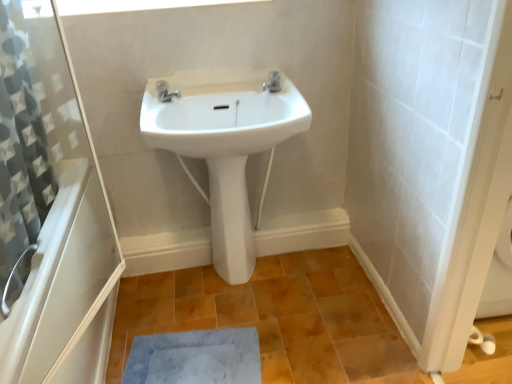
Question: From a real-world perspective, relative to satin nickel faucet at center, which is counted as the first tap, starting from the right, is white glossy bidet at center vertically above or below?

Choices:
 (A) below
 (B) above

Answer: (A)

Question: In the image, is white glossy bidet at center positioned in front of or behind satin nickel faucet at center, which is counted as the first tap, starting from the right?

Choices:
 (A) front
 (B) behind

Answer: (B)

Question: Based on their relative distances, which object is farther from the blue fuzzy mat at lower center?

Choices:
 (A) transparent plastic window screen at upper center
 (B) white glossy bath at lower left
 (C) white ceramic sink at center
 (D) polished chrome tap at upper center, the second tap positioned from the right
 (E) satin nickel faucet at center, the second tap when ordered from left to right

Answer: (A)

Question: Based on their relative distances, which object is farther from the transparent plastic window screen at upper center?

Choices:
 (A) blue fuzzy mat at lower center
 (B) white glossy bidet at center
 (C) white ceramic sink at center
 (D) polished chrome tap at upper center, the second tap positioned from the right
 (E) satin nickel faucet at center, which is counted as the first tap, starting from the right

Answer: (A)